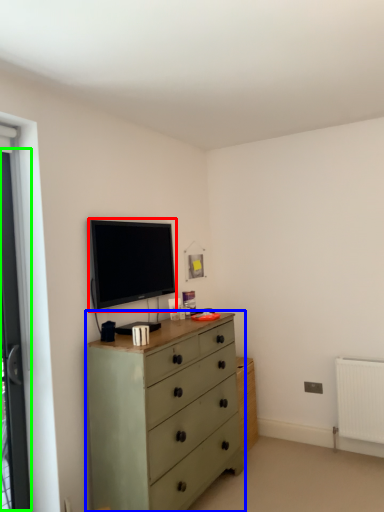
Question: Which object is the closest to the television (highlighted by a red box)? Choose among these: chest of drawers (highlighted by a blue box) or screen door (highlighted by a green box).

Choices:
 (A) chest of drawers
 (B) screen door

Answer: (A)